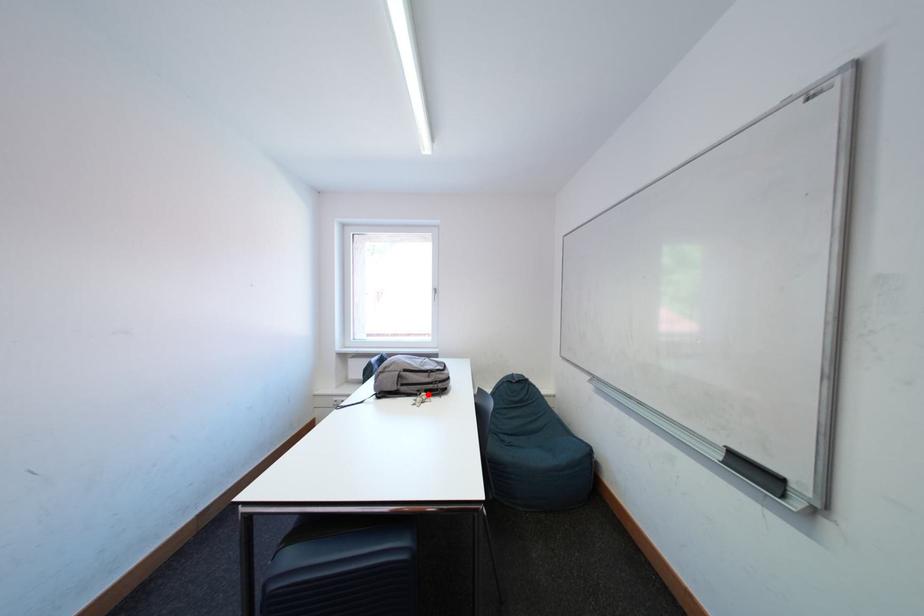
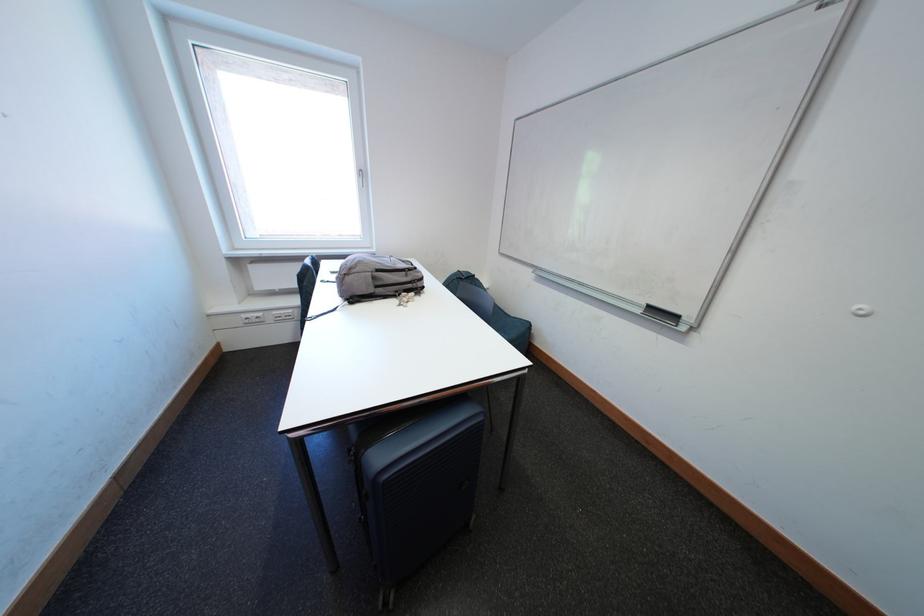
Question: I am providing you with two images of the same scene from different viewpoints. Given a red point in image1, look at the same physical point in image2. Is it:

Choices:
 (A) Closer to the viewpoint
 (B) Farther from the viewpoint

Answer: (A)